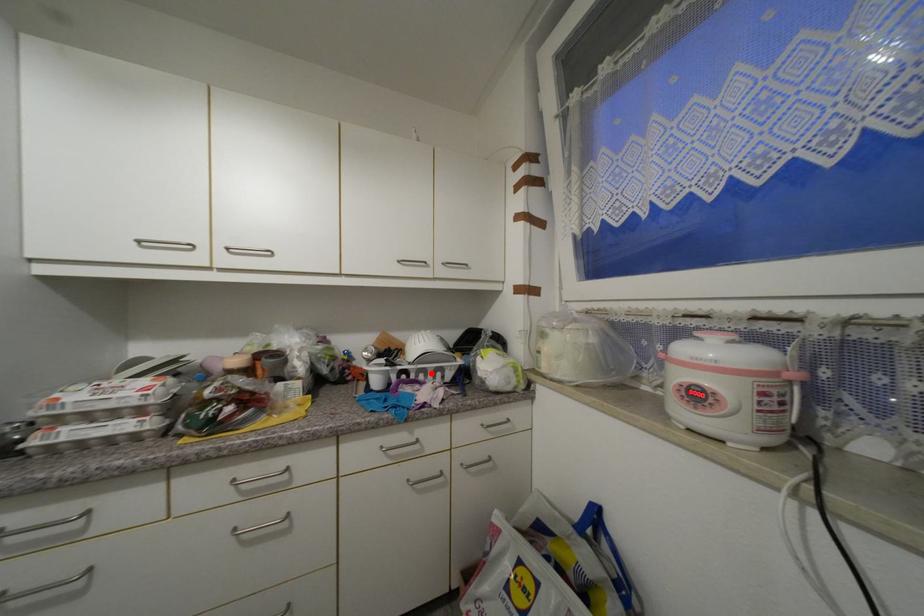
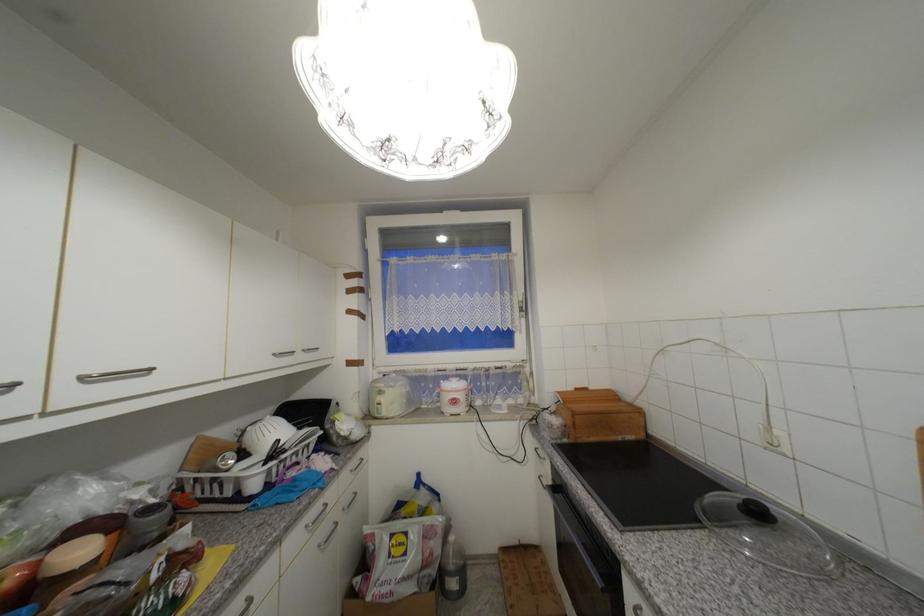
Where in the second image is the point corresponding to the highlighted location from the first image?

(301, 454)